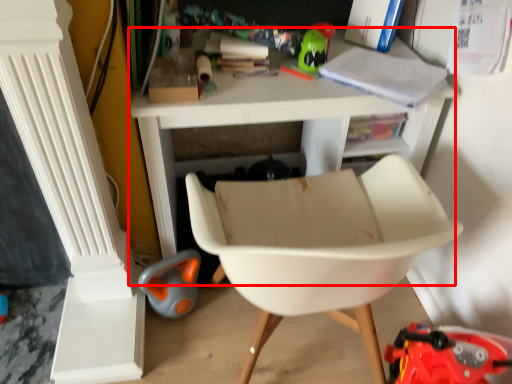
Question: Observing the image, what is the correct spatial positioning of table (annotated by the red box) in reference to chair?

Choices:
 (A) left
 (B) right

Answer: (A)